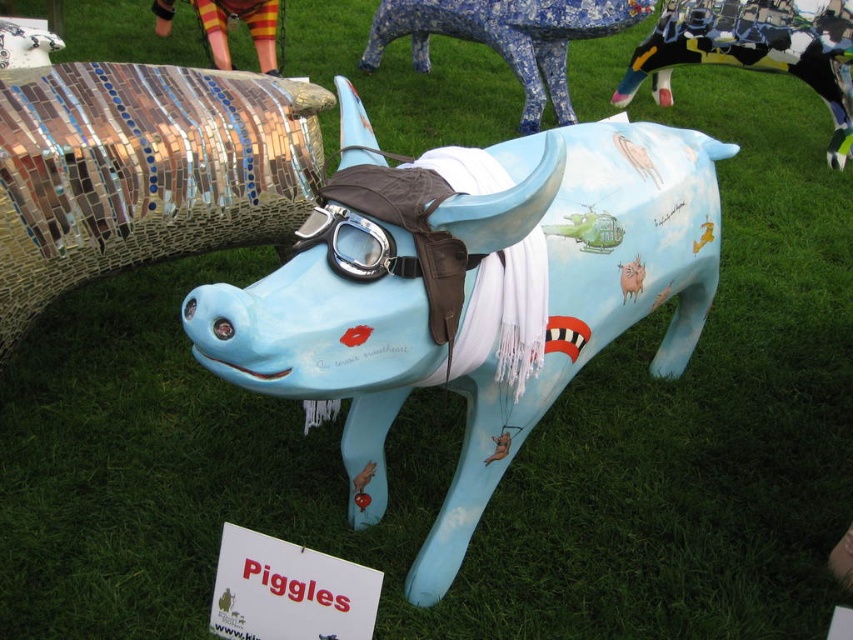
Does point (705, 24) lie behind point (412, 49)?

That is False.

Between point (840, 152) and point (543, 52), which one is positioned behind?

The point (543, 52) is behind.

You are a GUI agent. You are given a task and a screenshot of the screen. Output one action in this format:
    pyautogui.click(x=<x>, y=<y>)
    Task: Click on the black and white mosaic cow at upper right
    This screenshot has height=640, width=853.
    Given the screenshot: What is the action you would take?
    pyautogui.click(x=753, y=51)

Does blue mosaic cow at upper center appear on the right side of clear plastic goggles at center?

Indeed, blue mosaic cow at upper center is positioned on the right side of clear plastic goggles at center.

Which of these two, blue mosaic cow at upper center or clear plastic goggles at center, stands taller?

blue mosaic cow at upper center

This screenshot has height=640, width=853. What do you see at coordinates (508, 38) in the screenshot? I see `blue mosaic cow at upper center` at bounding box center [508, 38].

At what (x,y) coordinates should I click in order to perform the action: click on blue mosaic cow at upper center. Please return your answer as a coordinate pair (x, y). The height and width of the screenshot is (640, 853). Looking at the image, I should click on (508, 38).

Can you confirm if black and white mosaic cow at upper right is wider than clear plastic goggles at center?

Correct, the width of black and white mosaic cow at upper right exceeds that of clear plastic goggles at center.

Where is `black and white mosaic cow at upper right`? The width and height of the screenshot is (853, 640). black and white mosaic cow at upper right is located at coordinates (753, 51).

Where is `black and white mosaic cow at upper right`? The width and height of the screenshot is (853, 640). black and white mosaic cow at upper right is located at coordinates (753, 51).